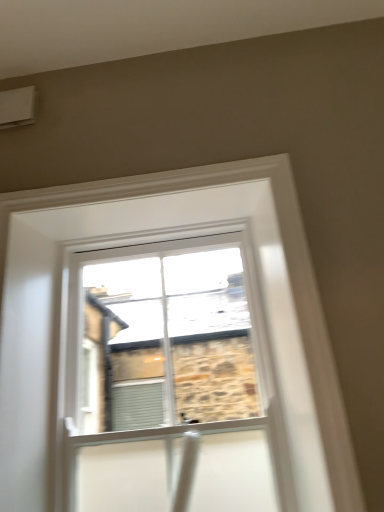
Question: Is white plastic air conditioning unit at upper left thinner than clear glass window at center?

Choices:
 (A) no
 (B) yes

Answer: (A)

Question: Is white plastic air conditioning unit at upper left closer to camera compared to clear glass window at center?

Choices:
 (A) yes
 (B) no

Answer: (B)

Question: Does white plastic air conditioning unit at upper left touch clear glass window at center?

Choices:
 (A) no
 (B) yes

Answer: (A)

Question: Is white plastic air conditioning unit at upper left further to the viewer compared to clear glass window at center?

Choices:
 (A) yes
 (B) no

Answer: (A)

Question: Is white plastic air conditioning unit at upper left wider than clear glass window at center?

Choices:
 (A) no
 (B) yes

Answer: (B)

Question: Does white plastic air conditioning unit at upper left have a lesser height compared to clear glass window at center?

Choices:
 (A) no
 (B) yes

Answer: (B)

Question: Is clear glass window at center further to camera compared to white plastic air conditioning unit at upper left?

Choices:
 (A) yes
 (B) no

Answer: (B)

Question: Is clear glass window at center positioned before white plastic air conditioning unit at upper left?

Choices:
 (A) yes
 (B) no

Answer: (A)

Question: Is clear glass window at center not within white plastic air conditioning unit at upper left?

Choices:
 (A) no
 (B) yes

Answer: (B)

Question: Does clear glass window at center turn towards white plastic air conditioning unit at upper left?

Choices:
 (A) no
 (B) yes

Answer: (A)

Question: Can white plastic air conditioning unit at upper left be found inside clear glass window at center?

Choices:
 (A) no
 (B) yes

Answer: (A)

Question: From a real-world perspective, is clear glass window at center positioned over white plastic air conditioning unit at upper left based on gravity?

Choices:
 (A) no
 (B) yes

Answer: (A)

Question: Is white plastic air conditioning unit at upper left taller or shorter than clear glass window at center?

Choices:
 (A) tall
 (B) short

Answer: (B)